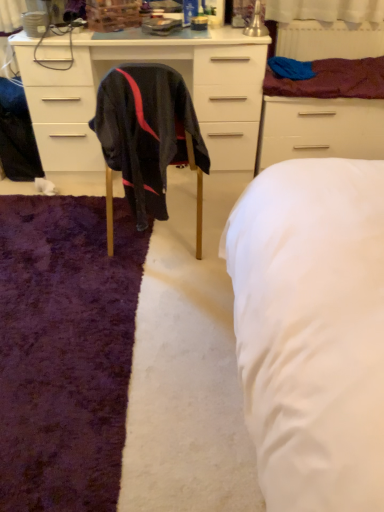
Image resolution: width=384 pixels, height=512 pixels. Describe the element at coordinates (333, 80) in the screenshot. I see `maroon fabric at upper right` at that location.

Locate an element on the screen. This screenshot has width=384, height=512. white painted radiator at upper right is located at coordinates (329, 40).

Measure the distance between point (142,132) and camera.

Point (142,132) is 1.60 meters away from camera.

In order to click on maroon fabric at upper right in this screenshot , I will do `click(333, 80)`.

Is white painted radiator at upper right far from white matte drawer at upper right?

No, white painted radiator at upper right is not far away from white matte drawer at upper right.

Which object is positioned more to the left, white painted radiator at upper right or white matte drawer at upper right?

white painted radiator at upper right.

Is white matte drawer at upper right at the back of white painted radiator at upper right?

white painted radiator at upper right does not have its back to white matte drawer at upper right.

From the image's perspective, which is above, white painted radiator at upper right or white matte drawer at upper right?

white painted radiator at upper right is shown above in the image.

Are black fabric chair at center and white painted radiator at upper right beside each other?

black fabric chair at center and white painted radiator at upper right are clearly separated.

Can you tell me how much black fabric chair at center and white painted radiator at upper right differ in facing direction?

The facing directions of black fabric chair at center and white painted radiator at upper right are 177 degrees apart.

Between point (147, 159) and point (278, 35), which one is positioned in front?

The point (147, 159) is closer to the camera.

Which is more to the right, black fabric chair at center or white painted radiator at upper right?

white painted radiator at upper right is more to the right.

From a real-world perspective, which object stands above the other?

In real-world perspective, black fabric chair at center is above.

Does white matte drawer at upper right turn towards black fabric chair at center?

No.

Which object is further away from the camera taking this photo, white matte drawer at upper right or black fabric chair at center?

Positioned behind is white matte drawer at upper right.

Would you say black fabric chair at center is part of white matte drawer at upper right's contents?

No, black fabric chair at center is not surrounded by white matte drawer at upper right.

Considering their positions, is white painted radiator at upper right located in front of or behind purple shaggy rug at lower left?

Clearly, white painted radiator at upper right is behind purple shaggy rug at lower left.

Identify the location of mat in front of the white painted radiator at upper right. The image size is (384, 512). (65, 350).

Consider the image. Which of these two, white painted radiator at upper right or purple shaggy rug at lower left, stands taller?

Standing taller between the two is white painted radiator at upper right.

Looking at this image, is purple shaggy rug at lower left completely or partially inside black fabric chair at center?

That's incorrect, purple shaggy rug at lower left is not inside black fabric chair at center.

How distant is black fabric chair at center from purple shaggy rug at lower left?

black fabric chair at center is 21.65 inches away from purple shaggy rug at lower left.

How different are the orientations of black fabric chair at center and purple shaggy rug at lower left in degrees?

They differ by 92 degrees in their facing directions.

I want to click on chair lying behind the purple shaggy rug at lower left, so click(146, 135).

From a real-world perspective, is white matte drawer at upper right under white painted radiator at upper right?

Yes, from a real-world perspective, white matte drawer at upper right is below white painted radiator at upper right.

From their relative heights in the image, would you say white matte drawer at upper right is taller or shorter than white painted radiator at upper right?

Clearly, white matte drawer at upper right is taller compared to white painted radiator at upper right.

Considering the relative positions of white matte drawer at upper right and white painted radiator at upper right in the image provided, is white matte drawer at upper right to the left of white painted radiator at upper right from the viewer's perspective?

In fact, white matte drawer at upper right is to the right of white painted radiator at upper right.

Who is more distant, purple shaggy rug at lower left or maroon fabric at upper right?

maroon fabric at upper right is more distant.

Where is `blanket above the purple shaggy rug at lower left (from the image's perspective)`? This screenshot has height=512, width=384. blanket above the purple shaggy rug at lower left (from the image's perspective) is located at coordinates tap(333, 80).

Considering the sizes of purple shaggy rug at lower left and maroon fabric at upper right in the image, is purple shaggy rug at lower left taller or shorter than maroon fabric at upper right?

Considering their sizes, purple shaggy rug at lower left has less height than maroon fabric at upper right.

Is maroon fabric at upper right surrounded by purple shaggy rug at lower left?

Actually, maroon fabric at upper right is outside purple shaggy rug at lower left.

Locate an element on the screen. The image size is (384, 512). drawer below the white painted radiator at upper right (from the image's perspective) is located at coordinates (319, 129).

There is a black fabric chair at center. Where is `radiator above it (from a real-world perspective)`? radiator above it (from a real-world perspective) is located at coordinates (329, 40).

Looking at the image, which one is located further to matte black cabinet at center, white painted radiator at upper right or white matte drawer at upper right?

white painted radiator at upper right.

When comparing their distances from white painted radiator at upper right, does maroon fabric at upper right or matte black cabinet at center seem further?

matte black cabinet at center lies further to white painted radiator at upper right than the other object.

Based on their spatial positions, is white painted radiator at upper right or maroon fabric at upper right further from white matte drawer at upper right?

white painted radiator at upper right lies further to white matte drawer at upper right than the other object.

Which object lies nearer to the anchor point white painted radiator at upper right, maroon fabric at upper right or white matte drawer at upper right?

maroon fabric at upper right lies closer to white painted radiator at upper right than the other object.

Looking at the image, which one is located further to black fabric chair at center, matte black cabinet at center or purple shaggy rug at lower left?

The object further to black fabric chair at center is matte black cabinet at center.

When comparing their distances from black fabric chair at center, does matte black cabinet at center or white matte drawer at upper right seem further?

white matte drawer at upper right is positioned further to the anchor black fabric chair at center.

Considering their positions, is maroon fabric at upper right positioned closer to matte black cabinet at center than white painted radiator at upper right?

maroon fabric at upper right is positioned closer to the anchor matte black cabinet at center.

From the image, which object appears to be nearer to white painted radiator at upper right, matte black cabinet at center or black fabric chair at center?

The object closer to white painted radiator at upper right is matte black cabinet at center.

Locate an element on the screen. blanket between purple shaggy rug at lower left and white matte drawer at upper right is located at coordinates (333, 80).

You are a GUI agent. You are given a task and a screenshot of the screen. Output one action in this format:
    pyautogui.click(x=<x>, y=<y>)
    Task: Click on the radiator located between purple shaggy rug at lower left and white matte drawer at upper right in the left-right direction
    The width and height of the screenshot is (384, 512).
    Given the screenshot: What is the action you would take?
    pyautogui.click(x=329, y=40)

Locate an element on the screen. The height and width of the screenshot is (512, 384). cabinetry located between purple shaggy rug at lower left and maroon fabric at upper right in the left-right direction is located at coordinates (148, 62).

Locate an element on the screen. This screenshot has width=384, height=512. blanket situated between purple shaggy rug at lower left and white painted radiator at upper right from left to right is located at coordinates (333, 80).